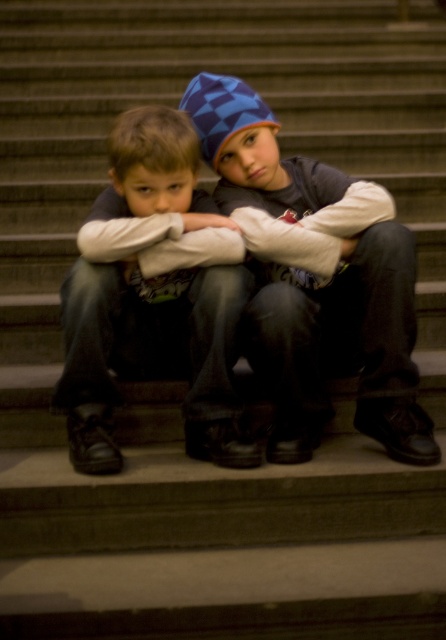
Question: Does blue checkered beanie at center appear on the right side of matte black jacket at center?

Choices:
 (A) no
 (B) yes

Answer: (B)

Question: Can you confirm if blue checkered beanie at center is bigger than matte black jacket at center?

Choices:
 (A) yes
 (B) no

Answer: (A)

Question: Which point is farther from the camera taking this photo?

Choices:
 (A) (147, 214)
 (B) (304, 394)

Answer: (B)

Question: Does blue checkered beanie at center appear under matte black jacket at center?

Choices:
 (A) yes
 (B) no

Answer: (B)